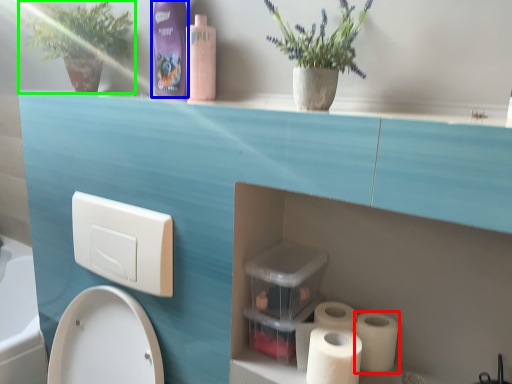
Question: Based on their relative distances, which object is nearer to toilet paper (highlighted by a red box)? Choose from cleaning product (highlighted by a blue box) and plant (highlighted by a green box).

Choices:
 (A) cleaning product
 (B) plant

Answer: (A)